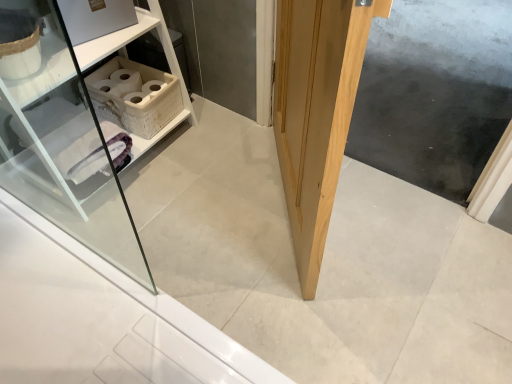
Question: From their relative heights in the image, would you say white wicker basket at upper left is taller or shorter than natural wood door at center?

Choices:
 (A) short
 (B) tall

Answer: (A)

Question: Is point (123, 99) positioned closer to the camera than point (288, 87)?

Choices:
 (A) closer
 (B) farther

Answer: (B)

Question: Which object is the closest to the natural wood screen door at center?

Choices:
 (A) white wicker basket at upper left
 (B) white wicker shelf at upper left
 (C) natural wood door at center

Answer: (C)

Question: Which object is the farthest from the white wicker basket at upper left?

Choices:
 (A) natural wood door at center
 (B) natural wood screen door at center
 (C) white wicker shelf at upper left

Answer: (B)